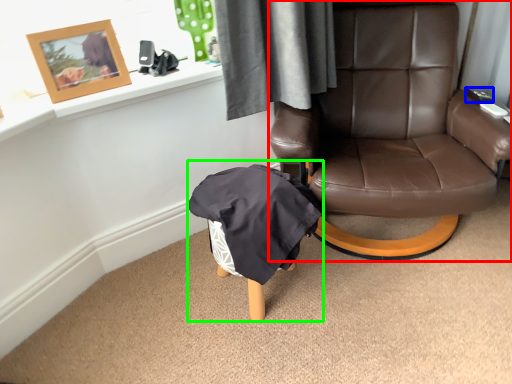
Question: Based on their relative distances, which object is farther from chair (highlighted by a red box)? Choose from remote control (highlighted by a blue box) and bean bag chair (highlighted by a green box).

Choices:
 (A) remote control
 (B) bean bag chair

Answer: (A)